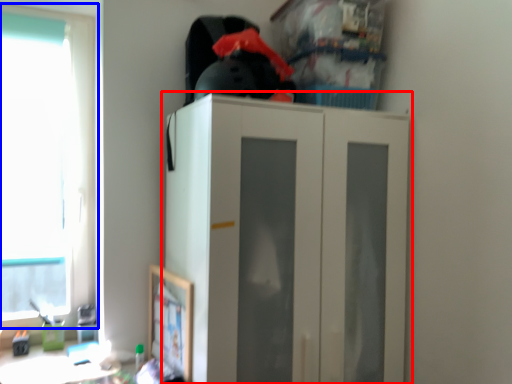
Question: Which of the following is the closest to the observer, cupboard (highlighted by a red box) or window (highlighted by a blue box)?

Choices:
 (A) cupboard
 (B) window

Answer: (A)